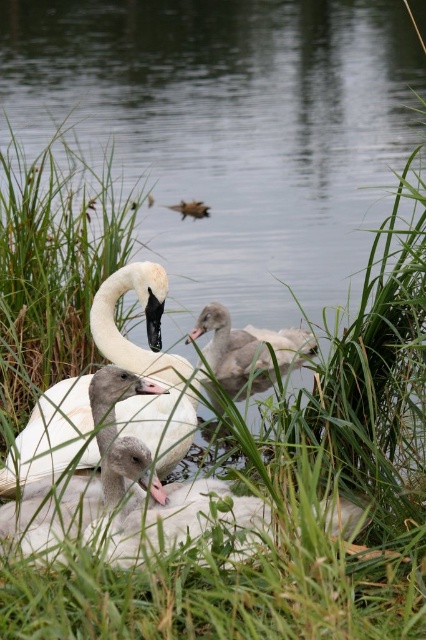
You are a wildlife photographer observing the scene. You need to capture a photo where both the white fluffy swan at center and the brown fuzzy duckling at center are clearly visible. Based on their sizes, which one might appear larger in the photo?

The white fluffy swan at center has a greater height compared to the brown fuzzy duckling at center, so it will appear larger in the photo.

You are a photographer trying to capture a closeup of the white fluffy swan at center and the brown fuzzy duckling at center. Which one should you focus on first if you want to take a photo that includes both in the frame?

The white fluffy swan at center is positioned on the right side of the brown fuzzy duckling at center, so you should focus on the brown fuzzy duckling at center first to ensure both are in the frame.